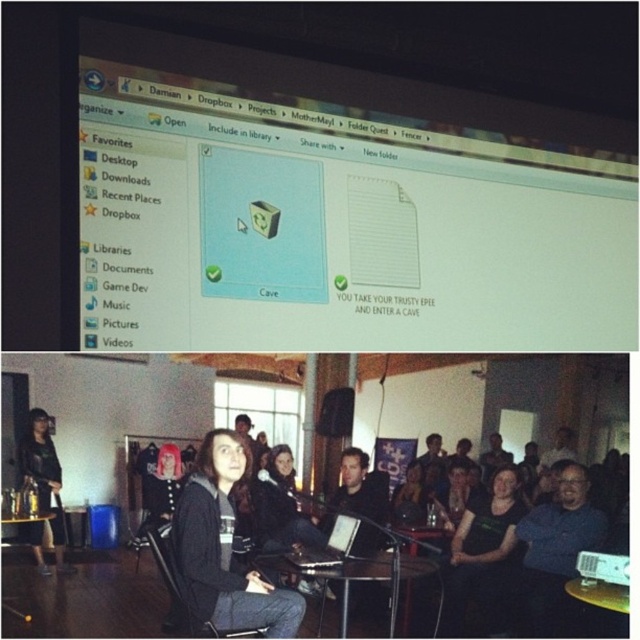
Is black leather jacket at center thinner than black matte laptop at center?

Indeed, black leather jacket at center has a lesser width compared to black matte laptop at center.

How far apart are black leather jacket at center and black matte laptop at center?

29.27 inches

Describe the element at coordinates (44, 476) in the screenshot. I see `black leather jacket at center` at that location.

Identify the location of black leather jacket at center. Image resolution: width=640 pixels, height=640 pixels. (44, 476).

Does black fabric chair at center have a lesser width compared to matte black jacket at center?

Incorrect, black fabric chair at center's width is not less than matte black jacket at center's.

Does black fabric chair at center appear on the left side of matte black jacket at center?

In fact, black fabric chair at center is to the right of matte black jacket at center.

Between point (209, 621) and point (150, 481), which one is positioned in front?

Point (209, 621)

The height and width of the screenshot is (640, 640). What are the coordinates of `black fabric chair at center` in the screenshot? It's located at (164, 570).

Can you confirm if black leather jacket at center is smaller than black fabric speaker at center?

No.

Measure the distance between black leather jacket at center and camera.

black leather jacket at center is 5.06 feet away from camera.

Describe the element at coordinates (44, 476) in the screenshot. I see `black leather jacket at center` at that location.

Where is `black leather jacket at center`? The image size is (640, 640). black leather jacket at center is located at coordinates (44, 476).